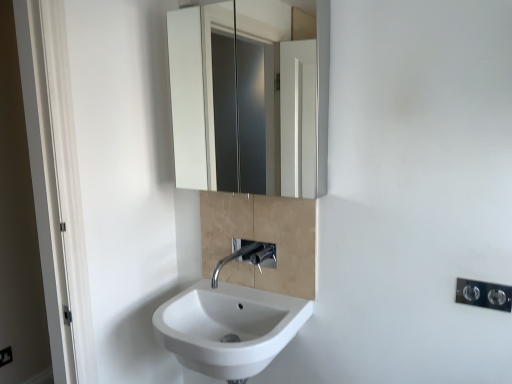
Question: Is white glossy sink at lower center placed right next to polished chrome faucet at center?

Choices:
 (A) yes
 (B) no

Answer: (B)

Question: Is white glossy sink at lower center outside of polished chrome faucet at center?

Choices:
 (A) no
 (B) yes

Answer: (B)

Question: Considering the relative sizes of white glossy sink at lower center and polished chrome faucet at center in the image provided, is white glossy sink at lower center taller than polished chrome faucet at center?

Choices:
 (A) yes
 (B) no

Answer: (A)

Question: Does white glossy sink at lower center have a larger size compared to polished chrome faucet at center?

Choices:
 (A) no
 (B) yes

Answer: (B)

Question: From the image's perspective, is white glossy sink at lower center on polished chrome faucet at center?

Choices:
 (A) no
 (B) yes

Answer: (A)

Question: Is polished chrome light switch at lower right situated inside black plastic electric outlet at lower right or outside?

Choices:
 (A) inside
 (B) outside

Answer: (B)

Question: Considering the positions of polished chrome light switch at lower right and black plastic electric outlet at lower right in the image, is polished chrome light switch at lower right taller or shorter than black plastic electric outlet at lower right?

Choices:
 (A) tall
 (B) short

Answer: (B)

Question: Considering the relative positions of polished chrome light switch at lower right and black plastic electric outlet at lower right in the image provided, is polished chrome light switch at lower right to the left or to the right of black plastic electric outlet at lower right?

Choices:
 (A) right
 (B) left

Answer: (A)

Question: Is point (500, 304) positioned closer to the camera than point (6, 352)?

Choices:
 (A) closer
 (B) farther

Answer: (A)

Question: From the image's perspective, relative to white glossy sink at lower center, is polished chrome faucet at center above or below?

Choices:
 (A) above
 (B) below

Answer: (A)

Question: Does point (251, 263) appear closer or farther from the camera than point (265, 360)?

Choices:
 (A) closer
 (B) farther

Answer: (B)

Question: Is polished chrome faucet at center taller or shorter than white glossy sink at lower center?

Choices:
 (A) short
 (B) tall

Answer: (A)

Question: From a real-world perspective, is polished chrome faucet at center above or below white glossy sink at lower center?

Choices:
 (A) below
 (B) above

Answer: (B)

Question: Is point (10, 349) closer or farther from the camera than point (231, 253)?

Choices:
 (A) farther
 (B) closer

Answer: (A)

Question: In the image, is black plastic electric outlet at lower right on the left side or the right side of polished chrome faucet at center?

Choices:
 (A) left
 (B) right

Answer: (A)